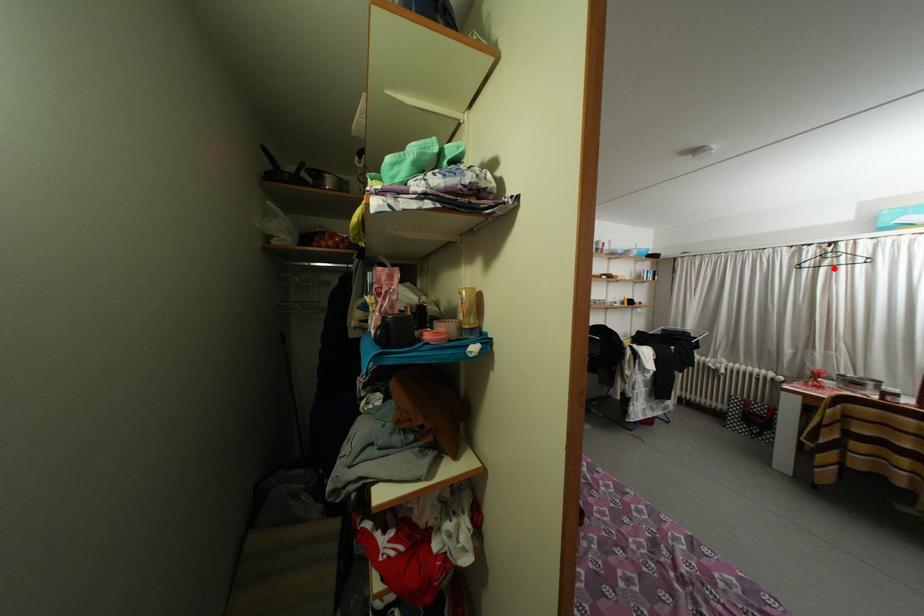
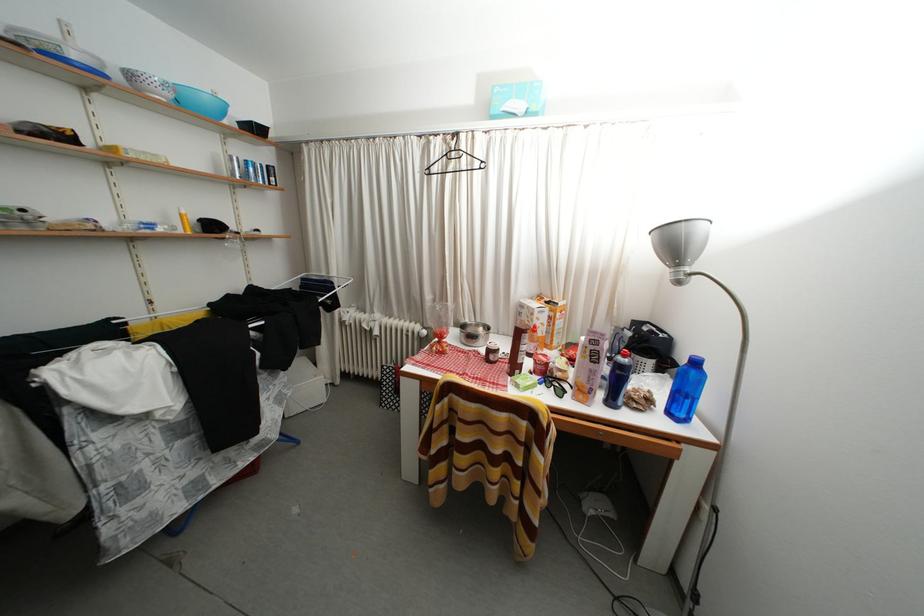
Question: I am providing you with two images of the same scene from different viewpoints. Given a red point in image1, look at the same physical point in image2. Is it:

Choices:
 (A) Closer to the viewpoint
 (B) Farther from the viewpoint

Answer: (A)